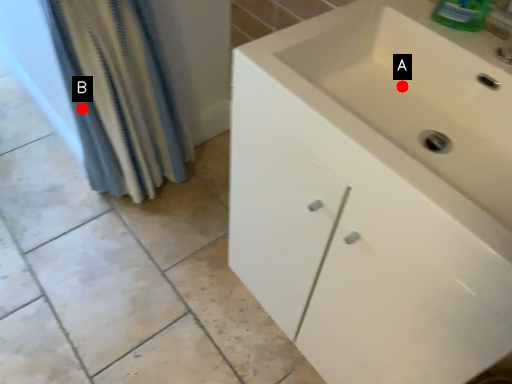
Question: Two points are circled on the image, labeled by A and B beside each circle. Which point is closer to the camera?

Choices:
 (A) A is closer
 (B) B is closer

Answer: (A)